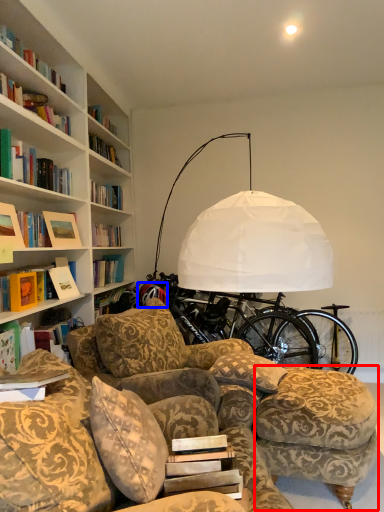
Question: Which object appears closest to the camera in this image, swivel chair (highlighted by a red box) or wheel (highlighted by a blue box)?

Choices:
 (A) swivel chair
 (B) wheel

Answer: (A)